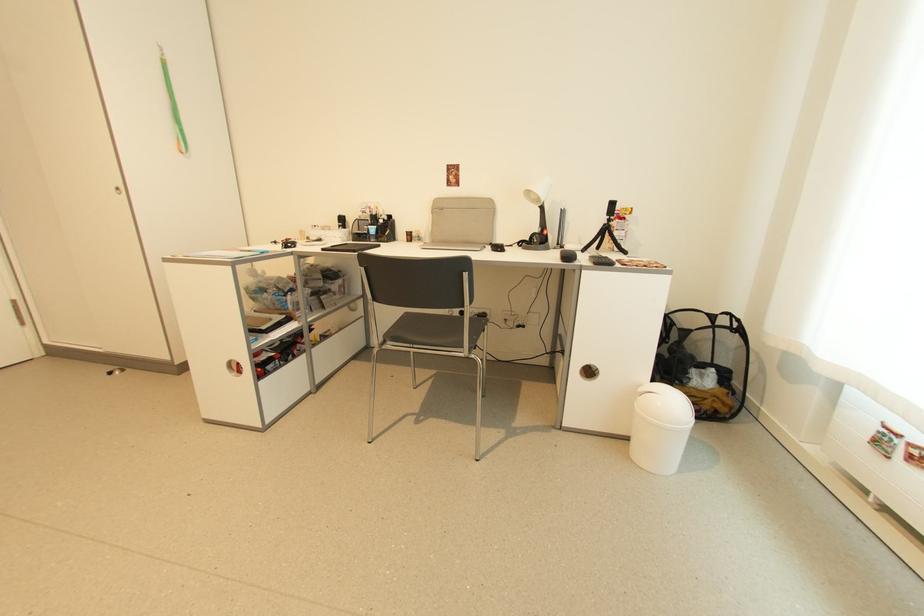
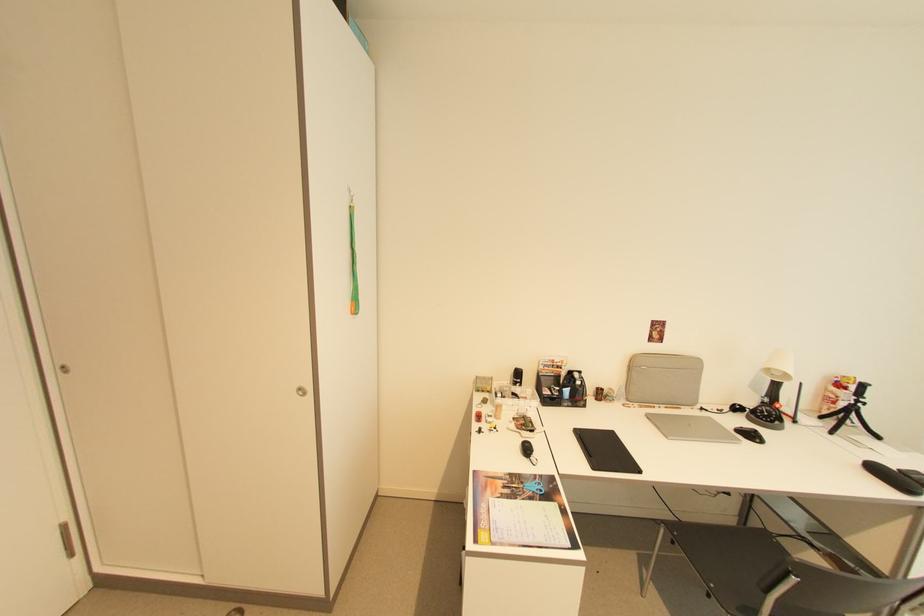
Find the pixel in the second image that matches pixel 444 211 in the first image.

(638, 366)